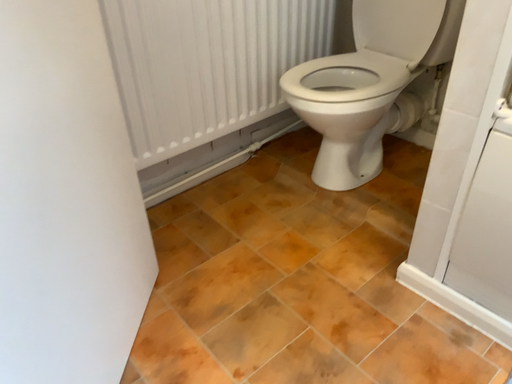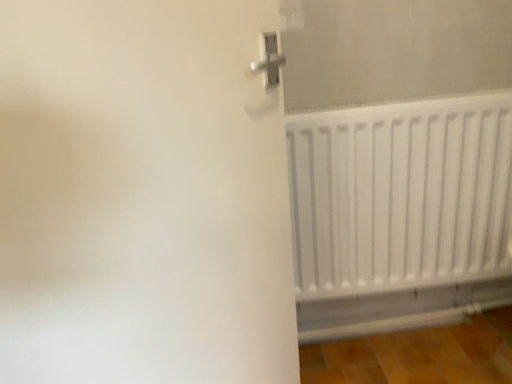
Question: Which way did the camera rotate in the video?

Choices:
 (A) rotated left
 (B) rotated right

Answer: (A)